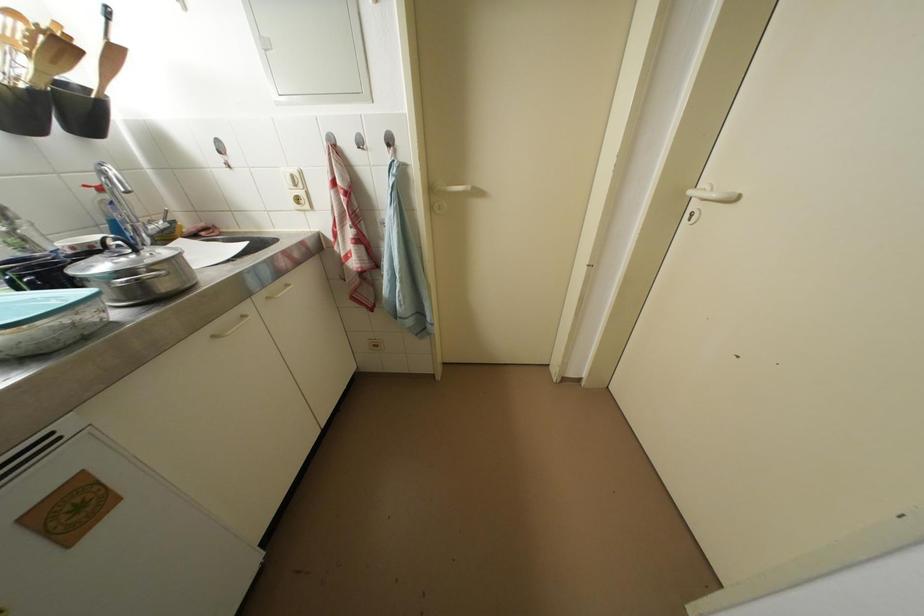
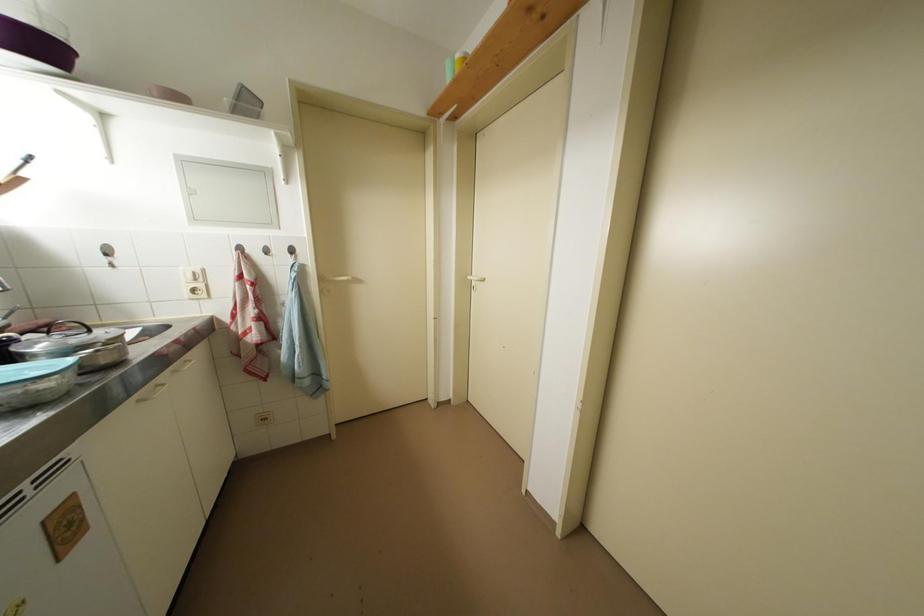
Question: Based on the continuous images, in which direction is the camera rotating? Reply with the corresponding letter.

Choices:
 (A) Left
 (B) Right
 (C) Up
 (D) Down

Answer: (B)